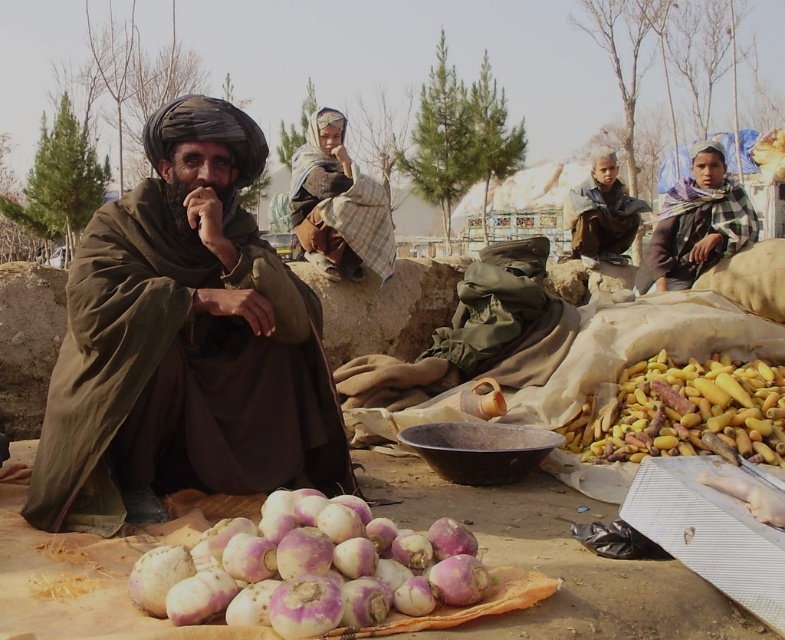
You are a customer at this market and want to buy the brown woolen robe at center and the yellow matte root vegetables at lower right. Which item takes up more horizontal space when placed side by side?

The yellow matte root vegetables at lower right take up more horizontal space because they are thicker than the brown woolen robe at center.